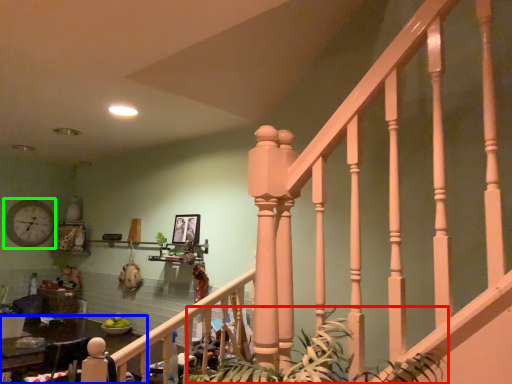
Question: Which object is positioned farthest from plant (highlighted by a red box)? Select from table (highlighted by a blue box) and clock (highlighted by a green box).

Choices:
 (A) table
 (B) clock

Answer: (B)